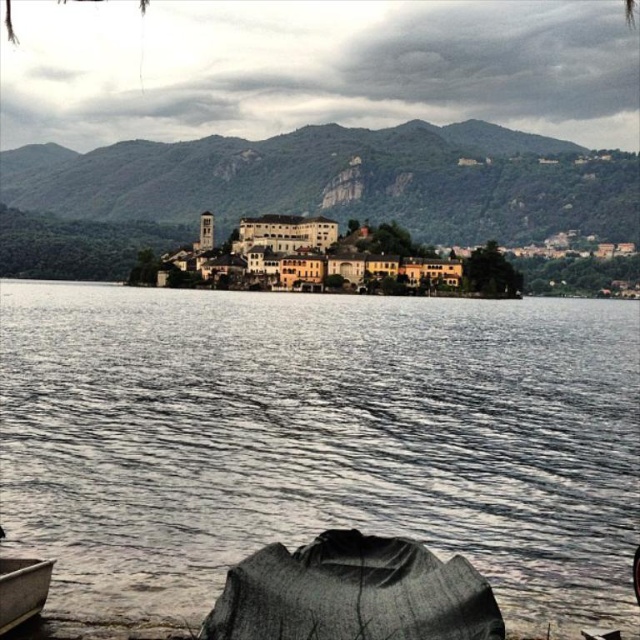
You are planning to cross the lake using the wooden canoe at lower left. Based on the scene, can the canoe fit entirely within the gray water at center without any part sticking out?

The gray water at center is larger in size than wooden canoe at lower left, so yes, the canoe can fit entirely within the gray water at center without any part sticking out.

You are a visitor standing at the lakeside and want to take a boat to the island. You see the wooden canoe at lower left and the gray water at center. Which direction should you paddle to reach the island?

The gray water at center is above the wooden canoe at lower left, so you should paddle towards the gray water at center to reach the island.